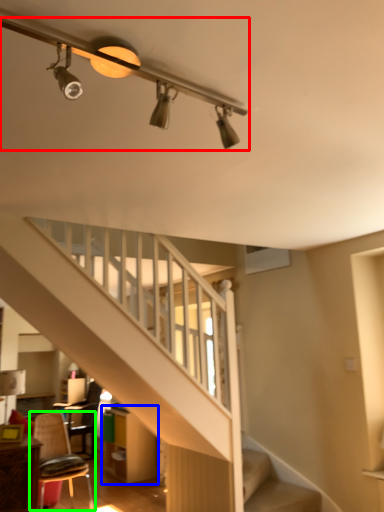
Question: Which object is positioned closest to light fixture (highlighted by a red box)? Select from dresser (highlighted by a blue box) and chair (highlighted by a green box).

Choices:
 (A) dresser
 (B) chair

Answer: (B)